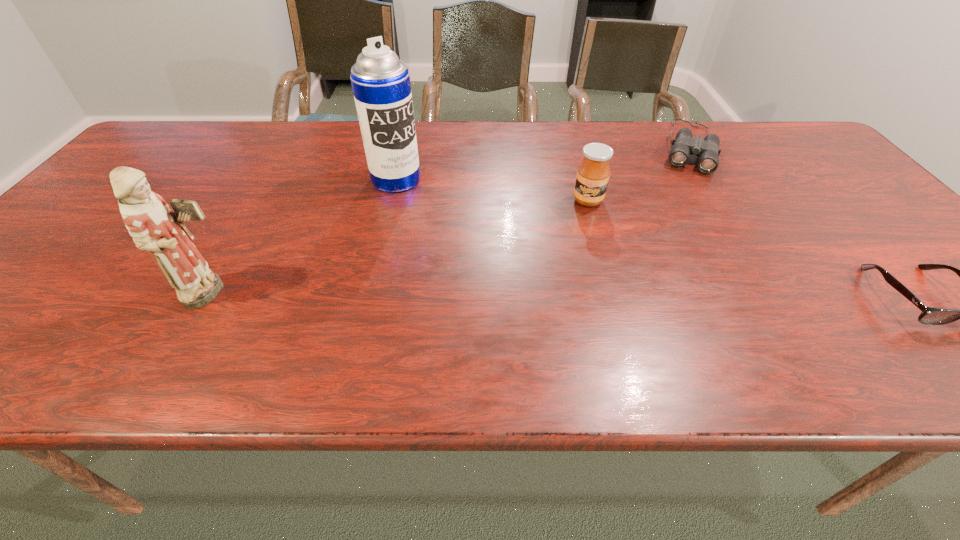
Identify the location of the closest object to the fourth shortest object. The height and width of the screenshot is (540, 960). (381, 86).

Identify the location of vacant space that satisfies the following two spatial constraints: 1. on the front side of the second object from left to right; 2. on the left side of the third tallest object. (392, 200).